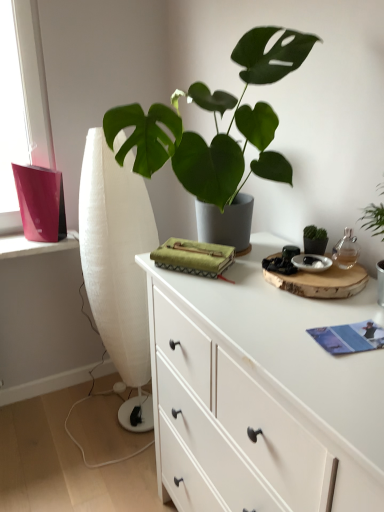
Question: Is white fabric curtain at left to the left of blue paper book at lower right from the viewer's perspective?

Choices:
 (A) yes
 (B) no

Answer: (A)

Question: Is white fabric curtain at left not near blue paper book at lower right?

Choices:
 (A) no
 (B) yes

Answer: (B)

Question: Is white fabric curtain at left closer to the viewer compared to blue paper book at lower right?

Choices:
 (A) no
 (B) yes

Answer: (A)

Question: From the image's perspective, is white fabric curtain at left on blue paper book at lower right?

Choices:
 (A) no
 (B) yes

Answer: (B)

Question: Is white fabric curtain at left not within blue paper book at lower right?

Choices:
 (A) yes
 (B) no

Answer: (A)

Question: From a real-world perspective, is blue paper book at lower right positioned above or below green matte plant at center?

Choices:
 (A) below
 (B) above

Answer: (A)

Question: In the image, is blue paper book at lower right positioned in front of or behind green matte plant at center?

Choices:
 (A) front
 (B) behind

Answer: (B)

Question: Which is correct: blue paper book at lower right is inside green matte plant at center, or outside of it?

Choices:
 (A) outside
 (B) inside

Answer: (A)

Question: Is point (360, 326) closer or farther from the camera than point (163, 144)?

Choices:
 (A) farther
 (B) closer

Answer: (B)

Question: From a real-world perspective, is green matte plant at center positioned above or below blue paper book at lower right?

Choices:
 (A) above
 (B) below

Answer: (A)

Question: Is point (246, 115) closer or farther from the camera than point (360, 330)?

Choices:
 (A) closer
 (B) farther

Answer: (B)

Question: Looking at their shapes, would you say green matte plant at center is wider or thinner than blue paper book at lower right?

Choices:
 (A) wide
 (B) thin

Answer: (A)

Question: Would you say green matte plant at center is to the left or to the right of blue paper book at lower right in the picture?

Choices:
 (A) right
 (B) left

Answer: (B)

Question: From their relative heights in the image, would you say white matte chest of drawers at center is taller or shorter than white fabric curtain at left?

Choices:
 (A) short
 (B) tall

Answer: (A)

Question: Is white matte chest of drawers at center inside or outside of white fabric curtain at left?

Choices:
 (A) inside
 (B) outside

Answer: (B)